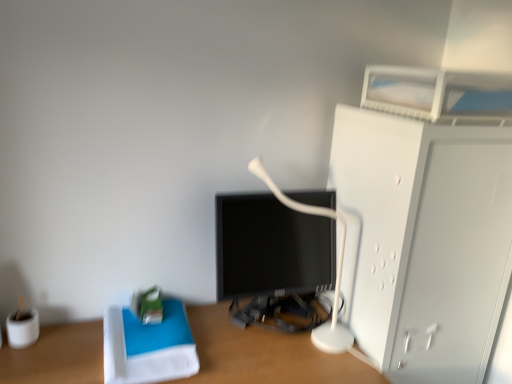
Question: Considering the relative sizes of white matte cabinet at right and wooden desk at center in the image provided, is white matte cabinet at right thinner than wooden desk at center?

Choices:
 (A) yes
 (B) no

Answer: (A)

Question: Considering the relative sizes of white matte cabinet at right and wooden desk at center in the image provided, is white matte cabinet at right bigger than wooden desk at center?

Choices:
 (A) yes
 (B) no

Answer: (B)

Question: Are white matte cabinet at right and wooden desk at center far apart?

Choices:
 (A) no
 (B) yes

Answer: (A)

Question: From a real-world perspective, is white matte cabinet at right physically below wooden desk at center?

Choices:
 (A) no
 (B) yes

Answer: (A)

Question: Is white matte cabinet at right closer to the viewer compared to wooden desk at center?

Choices:
 (A) no
 (B) yes

Answer: (A)

Question: From the image's perspective, is white plastic table lamp at center above or below white matte cabinet at right?

Choices:
 (A) below
 (B) above

Answer: (B)

Question: Is white plastic table lamp at center taller or shorter than white matte cabinet at right?

Choices:
 (A) tall
 (B) short

Answer: (B)

Question: Is white plastic table lamp at center inside the boundaries of white matte cabinet at right, or outside?

Choices:
 (A) outside
 (B) inside

Answer: (A)

Question: From a real-world perspective, is white plastic table lamp at center positioned above or below white matte cabinet at right?

Choices:
 (A) above
 (B) below

Answer: (A)

Question: Is wooden desk at center situated inside white matte cabinet at right or outside?

Choices:
 (A) outside
 (B) inside

Answer: (A)

Question: Is wooden desk at center taller or shorter than white matte cabinet at right?

Choices:
 (A) short
 (B) tall

Answer: (A)

Question: Is wooden desk at center bigger or smaller than white matte cabinet at right?

Choices:
 (A) big
 (B) small

Answer: (A)

Question: From a real-world perspective, is wooden desk at center above or below white matte cabinet at right?

Choices:
 (A) above
 (B) below

Answer: (B)

Question: Is white plastic table lamp at center inside the boundaries of wooden desk at center, or outside?

Choices:
 (A) inside
 (B) outside

Answer: (B)

Question: From a real-world perspective, is white plastic table lamp at center positioned above or below wooden desk at center?

Choices:
 (A) below
 (B) above

Answer: (B)